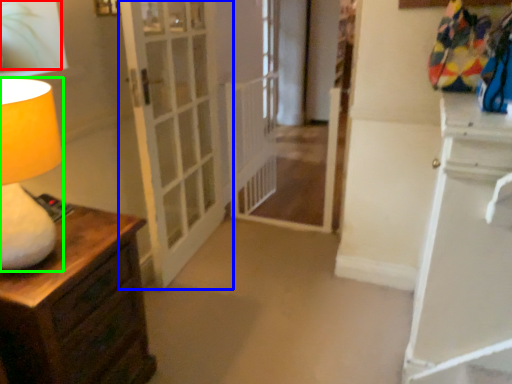
Question: Based on their relative distances, which object is nearer to plant (highlighted by a red box)? Choose from door (highlighted by a blue box) and table lamp (highlighted by a green box).

Choices:
 (A) door
 (B) table lamp

Answer: (B)